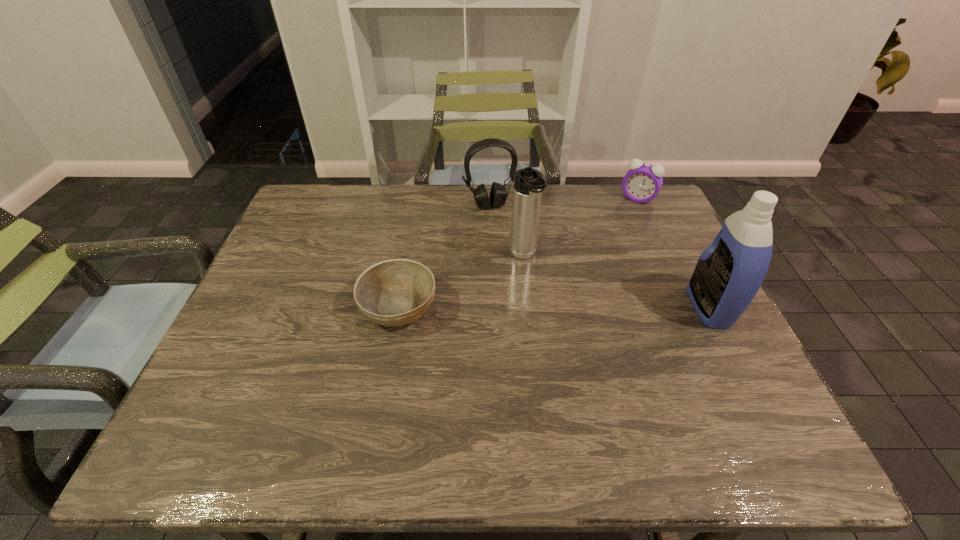
You are a GUI agent. You are given a task and a screenshot of the screen. Output one action in this format:
    pyautogui.click(x=<x>, y=<y>)
    Task: Click on the detergent present at the right edge
    The height and width of the screenshot is (540, 960).
    Given the screenshot: What is the action you would take?
    pyautogui.click(x=728, y=274)

The height and width of the screenshot is (540, 960). I want to click on alarm clock present at the right edge, so click(x=643, y=181).

I want to click on object at the far right corner, so click(x=643, y=181).

Find the location of a particular element. This screenshot has height=540, width=960. vacant space at the far edge of the desktop is located at coordinates (469, 191).

At what (x,y) coordinates should I click in order to perform the action: click on vacant space at the near edge of the desktop. Please return your answer as a coordinate pair (x, y). Looking at the image, I should click on (662, 374).

Find the location of a particular element. The height and width of the screenshot is (540, 960). vacant region at the left edge of the desktop is located at coordinates (276, 249).

Where is `free region at the right edge of the desktop`? free region at the right edge of the desktop is located at coordinates (670, 293).

This screenshot has height=540, width=960. Identify the location of vacant space at the far left corner. pos(309,219).

Where is `vacant area that lies between the third shortest object and the bowl`? This screenshot has height=540, width=960. vacant area that lies between the third shortest object and the bowl is located at coordinates (444, 256).

Identify the location of free space that is in between the third farthest object and the detergent. (616, 281).